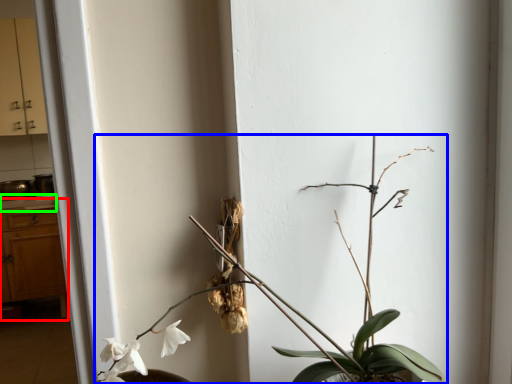
Question: Which object is the farthest from dresser (highlighted by a red box)? Choose among these: houseplant (highlighted by a blue box) or counter top (highlighted by a green box).

Choices:
 (A) houseplant
 (B) counter top

Answer: (A)